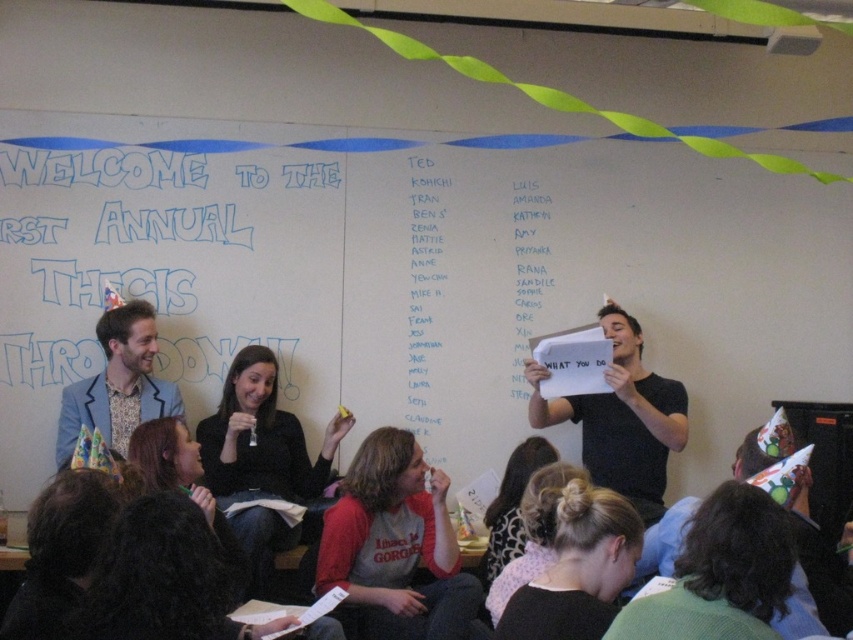
Question: Can you confirm if patterned fabric shirt at left is positioned below white paper at upper right?

Choices:
 (A) no
 (B) yes

Answer: (B)

Question: Is black matte paper at center above patterned fabric shirt at left?

Choices:
 (A) yes
 (B) no

Answer: (B)

Question: Which object is closer to the camera taking this photo?

Choices:
 (A) patterned fabric shirt at left
 (B) white paper list at center

Answer: (A)

Question: Does black matte paper at center appear under white paper list at center?

Choices:
 (A) yes
 (B) no

Answer: (A)

Question: Among these objects, which one is nearest to the camera?

Choices:
 (A) matte red hoodie at center
 (B) patterned fabric shirt at left
 (C) black matte paper at center

Answer: (A)

Question: Which object appears farthest from the camera in this image?

Choices:
 (A) whiteboard at upper center
 (B) white paper at upper right

Answer: (B)